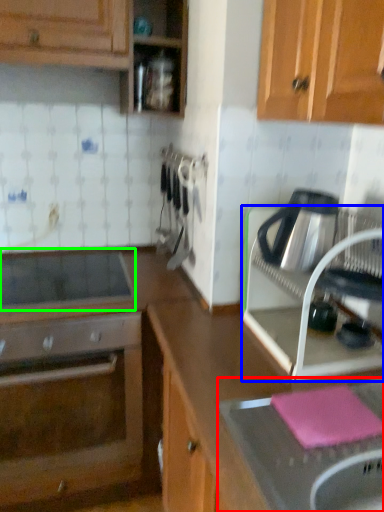
Question: Which is nearer to the sink (highlighted by a red box)? kitchen appliance (highlighted by a blue box) or home appliance (highlighted by a green box).

Choices:
 (A) kitchen appliance
 (B) home appliance

Answer: (A)